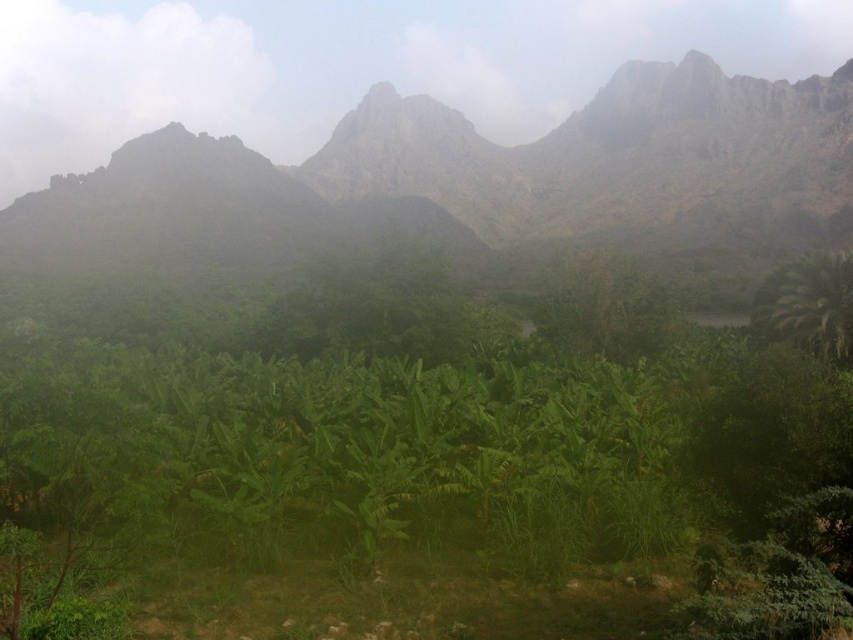
You are a hiker who wants to reach the rugged stone mountain range at upper center. You are currently standing at point [618,161]. Is this point a good starting position to begin your climb?

The point [618,161] is located on the rugged stone mountain range at upper center, so yes, this point is an ideal starting position to begin your climb since it is already on the mountain range.

You are standing at the origin of the coordinate system in the image. You see two points, point (666,198) and point (759,307). Which point is closer to you?

Point (759,307) is closer to you because it is in front of point (666,198).